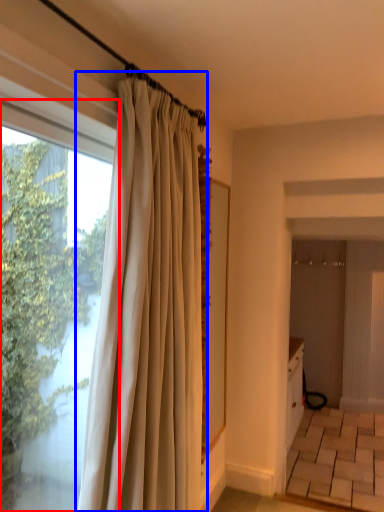
Question: Which object is further to the camera taking this photo, window (highlighted by a red box) or curtain (highlighted by a blue box)?

Choices:
 (A) window
 (B) curtain

Answer: (B)